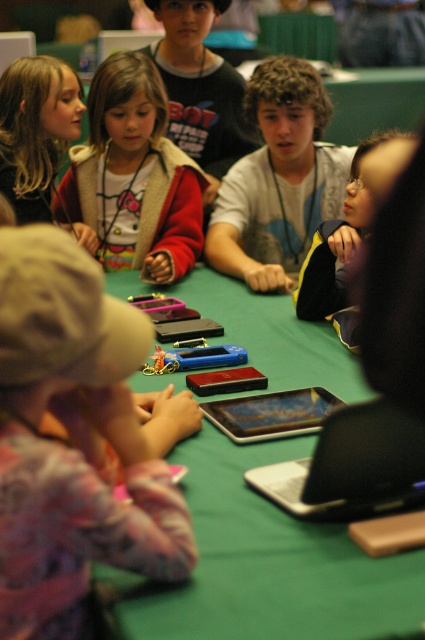
Which is above, silver metallic laptop at center or matte black jacket at center?

Positioned higher is matte black jacket at center.

Between silver metallic laptop at center and matte black jacket at center, which one is positioned lower?

Positioned lower is silver metallic laptop at center.

Where is `silver metallic laptop at center`? silver metallic laptop at center is located at coordinates (351, 467).

Is green matte table at center below matte black tablet at center?

No.

Is point (365, 621) positioned behind point (218, 408)?

No, it is not.

Where is `green matte table at center`? The image size is (425, 640). green matte table at center is located at coordinates (266, 564).

Can you confirm if green matte table at center is taller than matte black jacket at center?

No.

Does green matte table at center have a greater width compared to matte black jacket at center?

Indeed, green matte table at center has a greater width compared to matte black jacket at center.

I want to click on green matte table at center, so click(x=266, y=564).

Find the location of `green matte table at center`. green matte table at center is located at coordinates (266, 564).